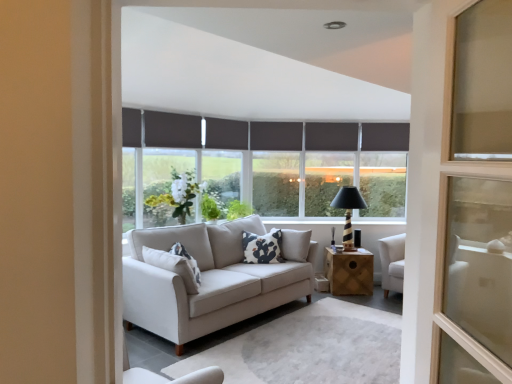
Measure the distance between dark grey fabric curtain at center, acting as the second curtain starting from the front, and camera.

5.06 meters.

Identify the location of dark grey fabric curtain at upper center, the first curtain in the front-to-back sequence. The image size is (512, 384). (170, 130).

The image size is (512, 384). Describe the element at coordinates (170, 130) in the screenshot. I see `dark grey fabric curtain at upper center, the first curtain in the front-to-back sequence` at that location.

You are a GUI agent. You are given a task and a screenshot of the screen. Output one action in this format:
    pyautogui.click(x=<x>, y=<y>)
    Task: Click on the white printed cushion at center
    
    Given the screenshot: What is the action you would take?
    pyautogui.click(x=262, y=247)

Describe the element at coordinates (163, 182) in the screenshot. I see `white glass vase at center, the first window positioned from the left` at that location.

The width and height of the screenshot is (512, 384). Describe the element at coordinates (276, 136) in the screenshot. I see `dark grey fabric curtain at center, the third curtain positioned from the left` at that location.

Locate an element on the screen. dark grey fabric curtain at center, acting as the second curtain starting from the front is located at coordinates (226, 134).

Considering the sizes of objects black striped wood table lamp at center and dark grey fabric curtain at center, the third curtain positioned from the left, in the image provided, who is taller, black striped wood table lamp at center or dark grey fabric curtain at center, the third curtain positioned from the left,?

With more height is black striped wood table lamp at center.

From a real-world perspective, is black striped wood table lamp at center positioned under dark grey fabric curtain at center, which is counted as the 1th curtain, starting from the back, based on gravity?

Yes, from a real-world perspective, black striped wood table lamp at center is beneath dark grey fabric curtain at center, which is counted as the 1th curtain, starting from the back.

From the image's perspective, who appears lower, black striped wood table lamp at center or dark grey fabric curtain at center, the third curtain viewed from the front?

black striped wood table lamp at center appears lower in the image.

Looking at this image, from a real-world perspective, is dark gray roller blind at upper center, arranged as the fifth window when viewed from the left, physically above dark grey fabric curtain at upper center, arranged as the third curtain when viewed from the back?

No, from a real-world perspective, dark gray roller blind at upper center, arranged as the fifth window when viewed from the left, is not above dark grey fabric curtain at upper center, arranged as the third curtain when viewed from the back.

Are dark gray roller blind at upper center, arranged as the fifth window when viewed from the left, and dark grey fabric curtain at upper center, which appears as the third curtain when viewed from the right, making contact?

There is a gap between dark gray roller blind at upper center, arranged as the fifth window when viewed from the left, and dark grey fabric curtain at upper center, which appears as the third curtain when viewed from the right.

Does point (377, 172) lie in front of point (149, 143)?

That is False.

This screenshot has height=384, width=512. I want to click on the 1st curtain positioned above the dark gray roller blind at upper center, arranged as the first window when viewed from the right (from the image's perspective), so click(170, 130).

Does white glass vase at center, which ranks as the 5th window in right-to-left order, have a larger size compared to black striped wood table lamp at center?

Correct, white glass vase at center, which ranks as the 5th window in right-to-left order, is larger in size than black striped wood table lamp at center.

Is white glass vase at center, the first window positioned from the left, next to black striped wood table lamp at center and touching it?

white glass vase at center, the first window positioned from the left, is not next to black striped wood table lamp at center, and they're not touching.

From the image's perspective, between white glass vase at center, which ranks as the 5th window in right-to-left order, and black striped wood table lamp at center, who is located below?

black striped wood table lamp at center is shown below in the image.

Does white printed cushion at center appear on the left side of dark gray roller blind at center, arranged as the 3th window when viewed from the right?

Yes, white printed cushion at center is to the left of dark gray roller blind at center, arranged as the 3th window when viewed from the right.

From the image's perspective, is white printed cushion at center located beneath dark gray roller blind at center, arranged as the 3th window when viewed from the right?

Yes.

Is white printed cushion at center with dark gray roller blind at center, arranged as the 3th window when viewed from the right?

No, white printed cushion at center is not next to dark gray roller blind at center, arranged as the 3th window when viewed from the right.

Is white printed cushion at center closer to the viewer compared to dark gray roller blind at center, the third window when ordered from left to right?

Yes, white printed cushion at center is closer to the camera.

From a real-world perspective, is wooden side table at center positioned over dark grey fabric curtain at center, which is counted as the 1th curtain, starting from the back, based on gravity?

No.

The height and width of the screenshot is (384, 512). There is a wooden side table at center. Identify the location of the 3rd curtain above it (from the image's perspective). pos(276,136).

Is wooden side table at center positioned with its back to dark grey fabric curtain at center, which is counted as the 1th curtain, starting from the back?

No, dark grey fabric curtain at center, which is counted as the 1th curtain, starting from the back, is not at the back of wooden side table at center.

Is wooden side table at center next to dark grey fabric curtain at center, the third curtain positioned from the left, and touching it?

wooden side table at center and dark grey fabric curtain at center, the third curtain positioned from the left, are clearly separated.

Image resolution: width=512 pixels, height=384 pixels. I want to click on the 1st curtain in front of the wooden side table at center, so click(226, 134).

Is wooden side table at center aimed at dark grey fabric curtain at center, which is the 2th curtain from back to front?

No, wooden side table at center does not turn towards dark grey fabric curtain at center, which is the 2th curtain from back to front.

Is wooden side table at center bigger than dark grey fabric curtain at center, acting as the 2th curtain starting from the right?

Yes.

Between wooden side table at center and dark grey fabric curtain at center, which is counted as the 2th curtain, starting from the left, which one has smaller width?

dark grey fabric curtain at center, which is counted as the 2th curtain, starting from the left, is thinner.

Considering the relative sizes of dark gray roller blind at center, the 4th window from the right, and dark gray roller blind at center, arranged as the 3th window when viewed from the right, in the image provided, is dark gray roller blind at center, the 4th window from the right, thinner than dark gray roller blind at center, arranged as the 3th window when viewed from the right,?

Indeed, dark gray roller blind at center, the 4th window from the right, has a lesser width compared to dark gray roller blind at center, arranged as the 3th window when viewed from the right.

Considering the positions of points (241, 153) and (273, 186), is point (241, 153) closer to camera compared to point (273, 186)?

Yes, it is.

Which is more to the right, dark gray roller blind at center, the second window in the left-to-right sequence, or dark gray roller blind at center, arranged as the 3th window when viewed from the right?

Positioned to the right is dark gray roller blind at center, arranged as the 3th window when viewed from the right.

This screenshot has width=512, height=384. I want to click on curtain that is the 3rd object located above the black striped wood table lamp at center (from the image's perspective), so click(276, 136).

Identify the location of window that is the 5th one when counting rightward from the dark grey fabric curtain at upper center, the first curtain in the front-to-back sequence. (383, 183).

Estimate the real-world distances between objects in this image. Which object is closer to white glass vase at center, the first window positioned from the left, white printed cushion at center or dark grey fabric curtain at center, the third curtain positioned from the left?

Based on the image, white printed cushion at center appears to be nearer to white glass vase at center, the first window positioned from the left.

Based on their spatial positions, is dark gray roller blind at center, the 4th window from the right, or white printed cushion at center closer to wooden side table at center?

white printed cushion at center is positioned closer to the anchor wooden side table at center.

Considering their positions, is dark gray roller blind at upper center, arranged as the first window when viewed from the right, positioned further to black striped wood table lamp at center than dark gray roller blind at center, the third window when ordered from left to right?

dark gray roller blind at center, the third window when ordered from left to right.

Based on their spatial positions, is dark grey fabric curtain at upper center, the first curtain in the front-to-back sequence, or wooden side table at center closer to black striped wood table lamp at center?

wooden side table at center is positioned closer to the anchor black striped wood table lamp at center.

Looking at this image, which object lies nearer to the anchor point wooden side table at center, dark grey fabric curtain at center, acting as the second curtain starting from the front, or dark grey fabric curtain at center, the third curtain positioned from the left?

dark grey fabric curtain at center, the third curtain positioned from the left.

In the scene shown: When comparing their distances from dark grey fabric curtain at center, which is counted as the 2th curtain, starting from the left, does white printed cushion at center or dark gray roller blind at center, arranged as the 3th window when viewed from the right, seem closer?

dark gray roller blind at center, arranged as the 3th window when viewed from the right.

Considering their positions, is black striped wood table lamp at center positioned closer to wooden side table at center than dark grey fabric curtain at center, acting as the 2th curtain starting from the right?

black striped wood table lamp at center.

From the image, which object appears to be nearer to dark gray roller blind at center, the third window when ordered from left to right, dark gray roller blind at upper center, arranged as the fifth window when viewed from the left, or dark grey fabric curtain at upper center, the 1th curtain from the left?

dark gray roller blind at upper center, arranged as the fifth window when viewed from the left, is positioned closer to the anchor dark gray roller blind at center, the third window when ordered from left to right.

Identify the location of window located between dark gray roller blind at center, the third window when ordered from left to right, and dark gray roller blind at upper center, arranged as the first window when viewed from the right, in the left-right direction. (326, 181).

This screenshot has height=384, width=512. I want to click on pillow that lies between dark grey fabric curtain at center, which is counted as the 1th curtain, starting from the back, and wooden side table at center from top to bottom, so click(262, 247).

At what (x,y) coordinates should I click in order to perform the action: click on table between white glass vase at center, the first window positioned from the left, and dark gray roller blind at upper center, arranged as the fifth window when viewed from the left, from left to right. Please return your answer as a coordinate pair (x, y). The image size is (512, 384). Looking at the image, I should click on (349, 272).

I want to click on curtain between dark grey fabric curtain at center, which is counted as the 2th curtain, starting from the left, and black striped wood table lamp at center, in the horizontal direction, so click(276, 136).